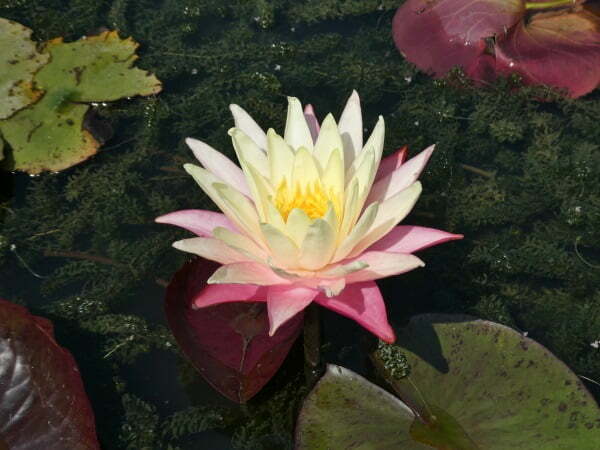
The image size is (600, 450). What are the coordinates of `dark green floor` in the screenshot? It's located at (300, 120), (250, 70), (141, 195), (587, 140), (562, 220).